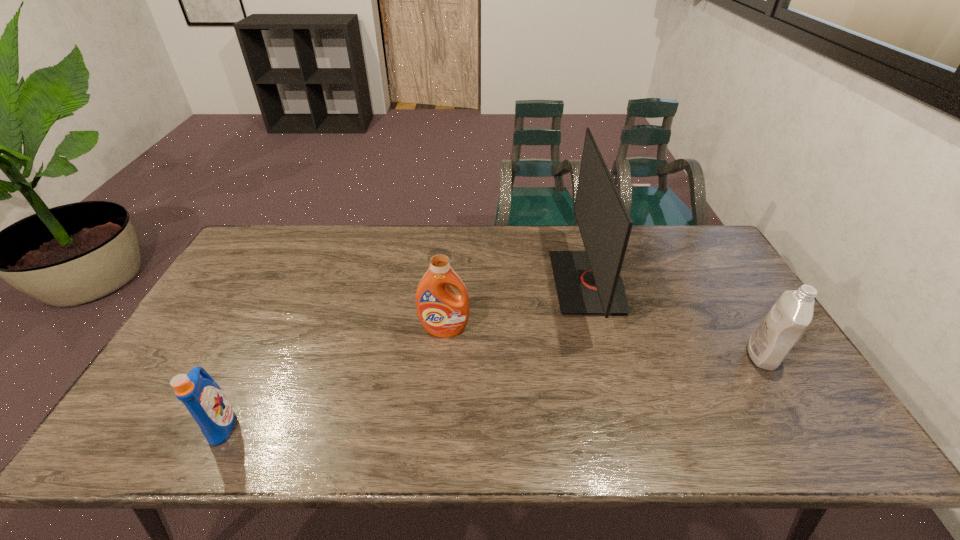
Where is `monitor`? This screenshot has width=960, height=540. monitor is located at coordinates (587, 282).

Identify the location of the tallest object. (587, 282).

This screenshot has width=960, height=540. I want to click on the third object from right to left, so click(x=442, y=313).

Locate an element on the screen. Image resolution: width=960 pixels, height=540 pixels. the farthest detergent is located at coordinates (442, 313).

Find the location of a particular element. the rightmost detergent is located at coordinates (785, 323).

Locate an element on the screen. the second farthest detergent is located at coordinates (785, 323).

Where is `the leftmost detergent`? This screenshot has height=540, width=960. the leftmost detergent is located at coordinates (204, 399).

Locate an element on the screen. The width and height of the screenshot is (960, 540). the nearest detergent is located at coordinates (204, 399).

Find the location of `free space located 0.190m on the screen side of the monitor`. free space located 0.190m on the screen side of the monitor is located at coordinates (493, 282).

Identify the location of vacant area located on the screen side of the monitor. (440, 282).